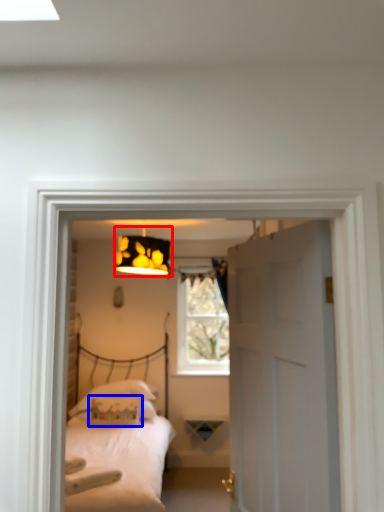
Question: Which of the following is the closest to the observer, lamp (highlighted by a red box) or pillow (highlighted by a blue box)?

Choices:
 (A) lamp
 (B) pillow

Answer: (A)